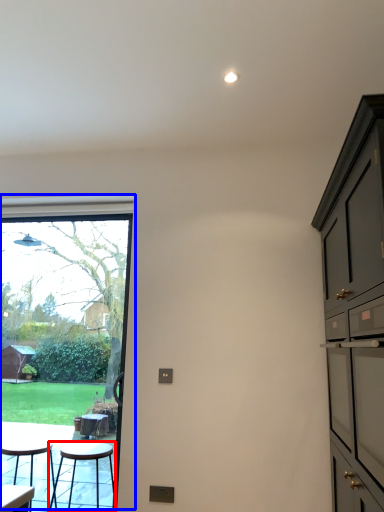
Question: Which point is further to the camera, stool (highlighted by a red box) or window (highlighted by a blue box)?

Choices:
 (A) stool
 (B) window

Answer: (B)